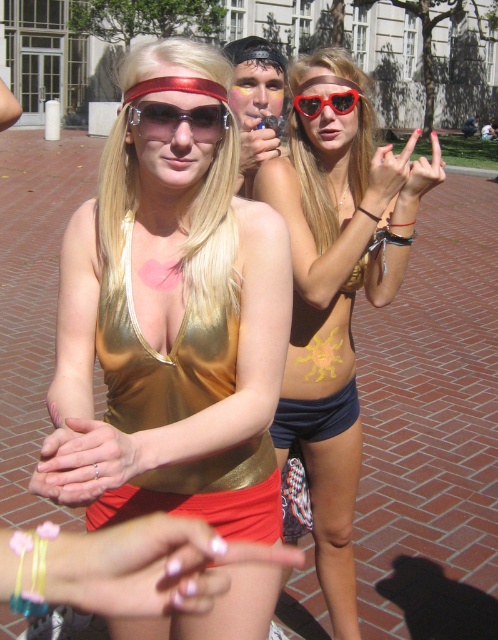
You are a photographer trying to capture a clear shot of the gold shiny dress at center and the red plastic sunglasses at upper center. Which object should you focus on first if you want to ensure both are in focus without moving the camera?

The gold shiny dress at center is positioned under the red plastic sunglasses at upper center. Since they are at different heights, you should focus on the red plastic sunglasses at upper center first, then adjust slightly downward to capture the gold shiny dress at center in focus.

You are a photographer trying to capture the gold shiny dress at center and the red plastic sunglasses at upper center in a single shot. Which object should you focus on first to ensure both are in focus?

The gold shiny dress at center is closer to the viewer than the red plastic sunglasses at upper center, so focus on the gold shiny dress at center first to ensure both are in focus.